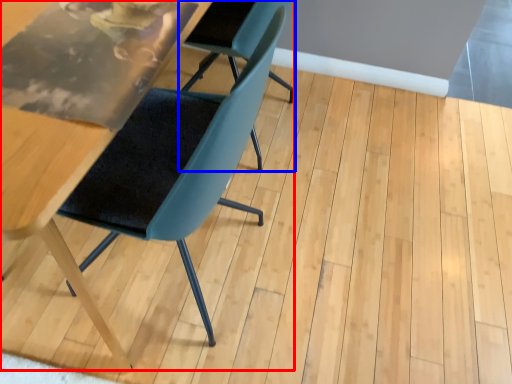
Question: Which object appears farthest to the camera in this image, chair (highlighted by a red box) or chair (highlighted by a blue box)?

Choices:
 (A) chair
 (B) chair

Answer: (B)